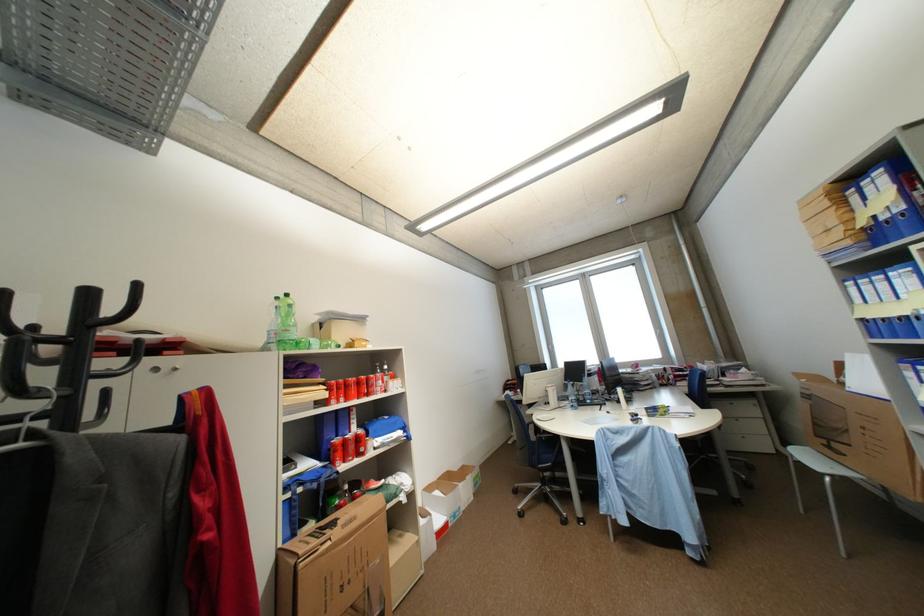
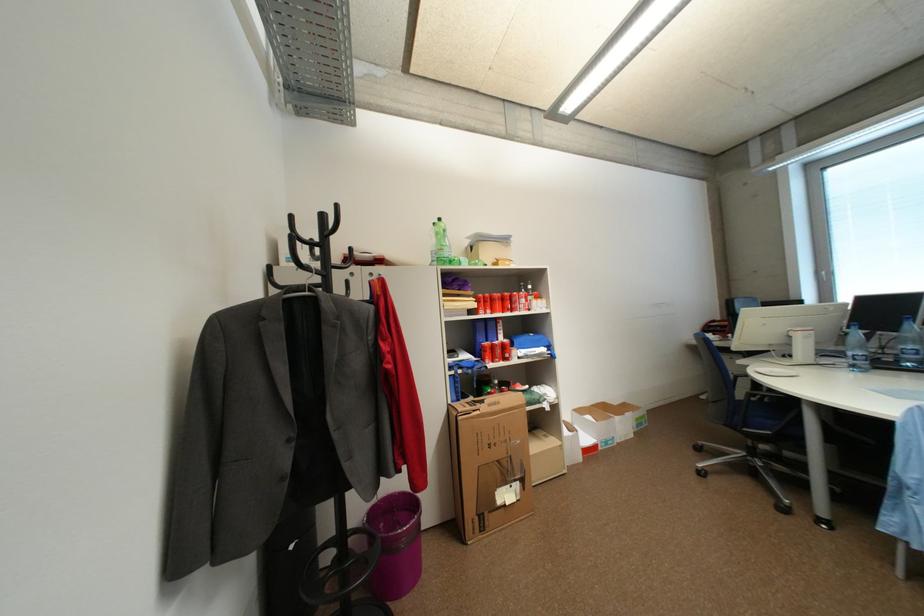
Locate, in the second image, the point that corresponds to [580,408] in the first image.

(861, 367)